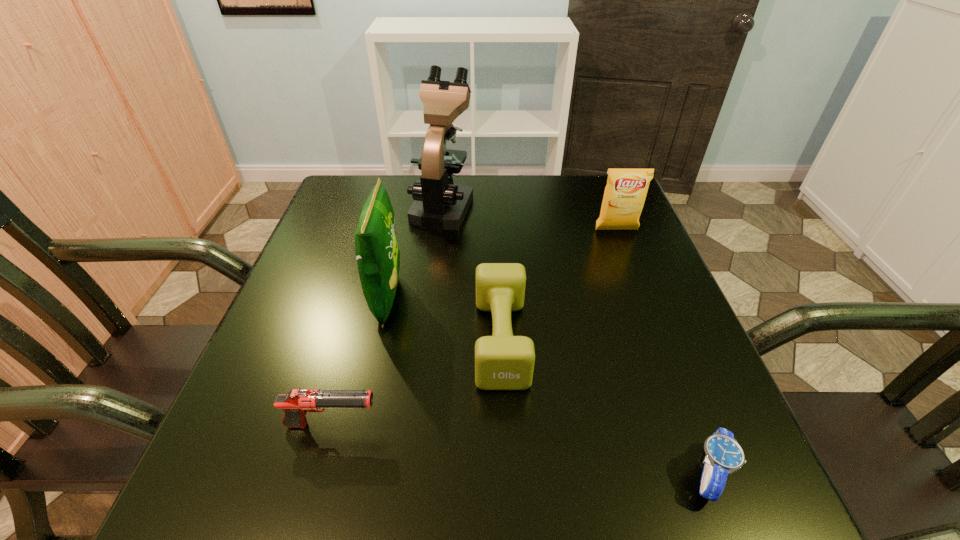
Identify the location of the tallest object. (439, 203).

Identify the location of the nearer crisp (potato chip). (378, 257).

Where is `the taller crisp (potato chip)`? This screenshot has height=540, width=960. the taller crisp (potato chip) is located at coordinates (378, 257).

Where is `the farther crisp (potato chip)`? the farther crisp (potato chip) is located at coordinates (625, 193).

Find the location of a particular element. Image resolution: width=960 pixels, height=540 pixels. the right crisp (potato chip) is located at coordinates (625, 193).

Locate an element on the screen. the fourth object from left to right is located at coordinates (502, 361).

The width and height of the screenshot is (960, 540). I want to click on the fifth farthest object, so click(x=295, y=404).

Where is `the nearest object`? This screenshot has width=960, height=540. the nearest object is located at coordinates (724, 455).

At what (x,y) coordinates should I click in order to perform the action: click on the shortest object. Please return your answer as a coordinate pair (x, y). Looking at the image, I should click on (724, 455).

This screenshot has width=960, height=540. Identify the location of free space located 0.200m on the front of the tallest object. (433, 285).